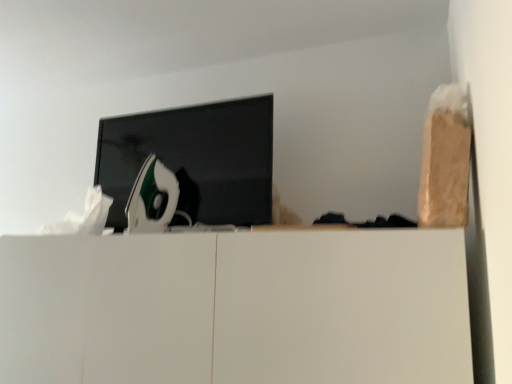
At what (x,y) coordinates should I click in order to perform the action: click on matte black monitor at upper center. Please return your answer as a coordinate pair (x, y). Looking at the image, I should click on 195,159.

Describe the element at coordinates (195, 159) in the screenshot. This screenshot has width=512, height=384. I see `matte black monitor at upper center` at that location.

The image size is (512, 384). In order to click on matte black monitor at upper center in this screenshot , I will do `click(195, 159)`.